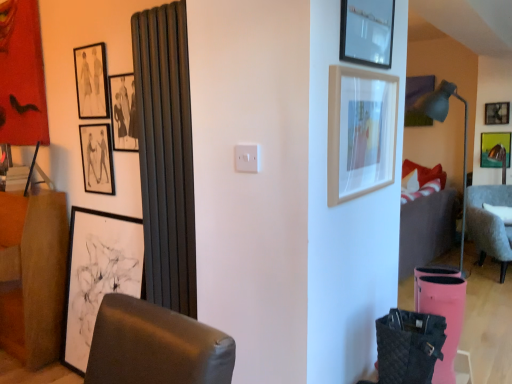
Question: From the image's perspective, is matte yellow picture frame at upper right, the 8th picture frame in the left-to-right sequence, under brown fabric dresser at left?

Choices:
 (A) yes
 (B) no

Answer: (B)

Question: From the image's perspective, is matte yellow picture frame at upper right, which appears as the 1th picture frame when viewed from the right, above brown fabric dresser at left?

Choices:
 (A) no
 (B) yes

Answer: (B)

Question: Is matte yellow picture frame at upper right, the 8th picture frame in the left-to-right sequence, far from brown fabric dresser at left?

Choices:
 (A) no
 (B) yes

Answer: (B)

Question: From a real-world perspective, is matte yellow picture frame at upper right, which appears as the 1th picture frame when viewed from the right, positioned over brown fabric dresser at left based on gravity?

Choices:
 (A) no
 (B) yes

Answer: (B)

Question: Considering the relative sizes of matte yellow picture frame at upper right, which appears as the 1th picture frame when viewed from the right, and brown fabric dresser at left in the image provided, is matte yellow picture frame at upper right, which appears as the 1th picture frame when viewed from the right, thinner than brown fabric dresser at left?

Choices:
 (A) yes
 (B) no

Answer: (A)

Question: Is matte yellow picture frame at upper right, the 8th picture frame in the left-to-right sequence, oriented away from brown fabric dresser at left?

Choices:
 (A) yes
 (B) no

Answer: (B)

Question: Does white matte picture frame at left, which appears as the 3th picture frame when viewed from the front, have a lesser height compared to matte yellow picture frame at upper right, the 8th picture frame in the left-to-right sequence?

Choices:
 (A) no
 (B) yes

Answer: (A)

Question: Can you see white matte picture frame at left, marked as the 6th picture frame in a back-to-front arrangement, touching matte yellow picture frame at upper right, the 8th picture frame in the left-to-right sequence?

Choices:
 (A) yes
 (B) no

Answer: (B)

Question: From the image's perspective, is white matte picture frame at left, arranged as the third picture frame when viewed from the left, located beneath matte yellow picture frame at upper right, the 1th picture frame positioned from the back?

Choices:
 (A) yes
 (B) no

Answer: (A)

Question: Is white matte picture frame at left, marked as the 6th picture frame in a back-to-front arrangement, to the right of matte yellow picture frame at upper right, which appears as the 1th picture frame when viewed from the right, from the viewer's perspective?

Choices:
 (A) no
 (B) yes

Answer: (A)

Question: Can you confirm if white matte picture frame at left, arranged as the third picture frame when viewed from the left, is wider than matte yellow picture frame at upper right, the 8th picture frame in the left-to-right sequence?

Choices:
 (A) yes
 (B) no

Answer: (A)

Question: From the image's perspective, is white matte picture frame at left, which is the 6th picture frame from right to left, over matte yellow picture frame at upper right, which appears as the 1th picture frame when viewed from the right?

Choices:
 (A) no
 (B) yes

Answer: (A)

Question: From a real-world perspective, is matte black picture frame at upper center, which is the 3th picture frame from right to left, below matte black picture frame at upper left, which ranks as the 2th picture frame in left-to-right order?

Choices:
 (A) no
 (B) yes

Answer: (A)